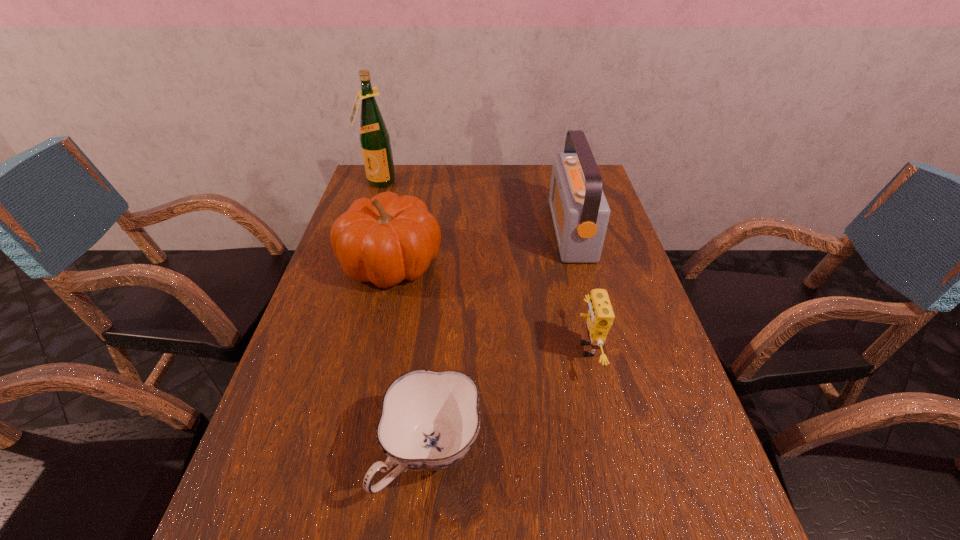
Where is `the tallest object`? The width and height of the screenshot is (960, 540). the tallest object is located at coordinates click(x=374, y=137).

Where is `the farthest object`? the farthest object is located at coordinates (374, 137).

Where is `the second tallest object`? the second tallest object is located at coordinates (580, 212).

At what (x,y) coordinates should I click in order to perform the action: click on the third tallest object. Please return your answer as a coordinate pair (x, y). This screenshot has width=960, height=540. Looking at the image, I should click on (384, 240).

Find the location of a particular element. sponge is located at coordinates (600, 316).

You are a GUI agent. You are given a task and a screenshot of the screen. Output one action in this format:
    pyautogui.click(x=<x>, y=<y>)
    Task: Click on the second nearest object
    The image size is (960, 540).
    Given the screenshot: What is the action you would take?
    pyautogui.click(x=600, y=316)

At what (x,y) coordinates should I click in order to perform the action: click on chinaware. Please return your answer as a coordinate pair (x, y). Looking at the image, I should click on (429, 420).

The image size is (960, 540). Identify the location of the nearest object. (429, 420).

This screenshot has width=960, height=540. What are the coordinates of `vacant space situated 0.070m on the front-facing side of the tallest object` in the screenshot? It's located at (372, 201).

At what (x,y) coordinates should I click in order to perform the action: click on free space located on the front-facing side of the radio receiver. Please return your answer as a coordinate pair (x, y). This screenshot has width=960, height=540. Looking at the image, I should click on (505, 231).